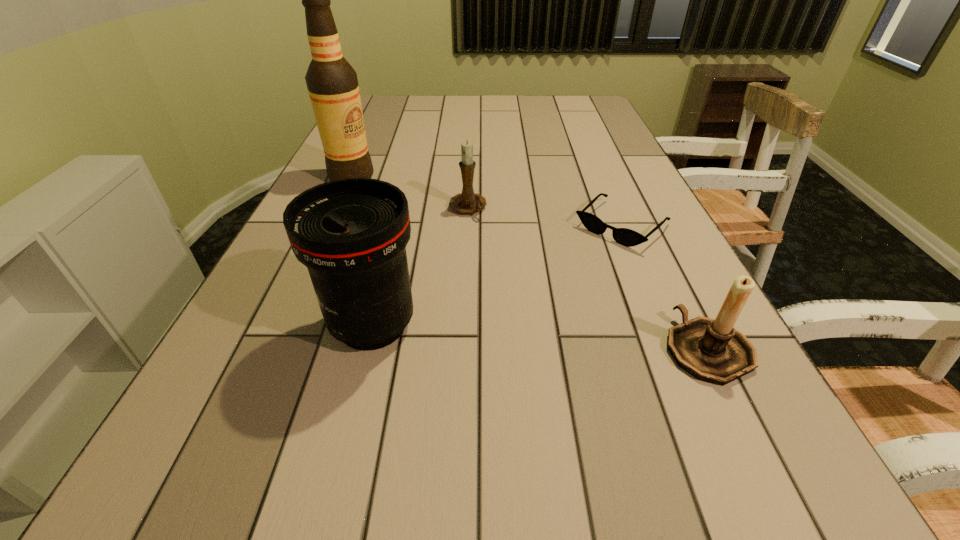
You are a GUI agent. You are given a task and a screenshot of the screen. Output one action in this format:
    pyautogui.click(x=<x>, y=<y>)
    Task: Click on the telephoto lens
    This screenshot has height=540, width=960.
    Given the screenshot: What is the action you would take?
    pyautogui.click(x=351, y=234)

Identify the location of the fourth shortest object. This screenshot has width=960, height=540. (351, 234).

Where is `the nearer candle holder`? the nearer candle holder is located at coordinates (711, 350).

Identify the location of the tallest object. pyautogui.click(x=332, y=83).

Find the location of a particular element. The height and width of the screenshot is (540, 960). the farthest object is located at coordinates (332, 83).

Find the location of `the farther candle holder`. the farther candle holder is located at coordinates (467, 202).

Find the location of `the third object from left to right`. the third object from left to right is located at coordinates (467, 202).

You are a GUI agent. You are given a task and a screenshot of the screen. Output one action in this format:
    pyautogui.click(x=<x>, y=<y>)
    Task: Click on the shortest object
    The height and width of the screenshot is (540, 960).
    Given the screenshot: What is the action you would take?
    pyautogui.click(x=624, y=236)

The image size is (960, 540). I want to click on free location located on the right of the fourth object from right to left, so click(601, 325).

Locate an element on the screen. Image resolution: width=960 pixels, height=540 pixels. vacant space situated on the left of the nearer candle holder is located at coordinates pos(591,349).